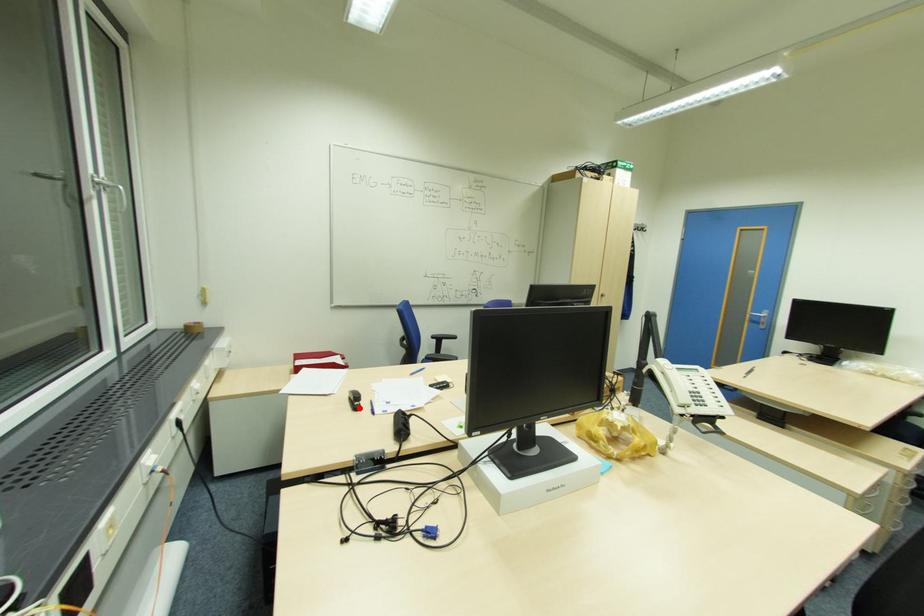
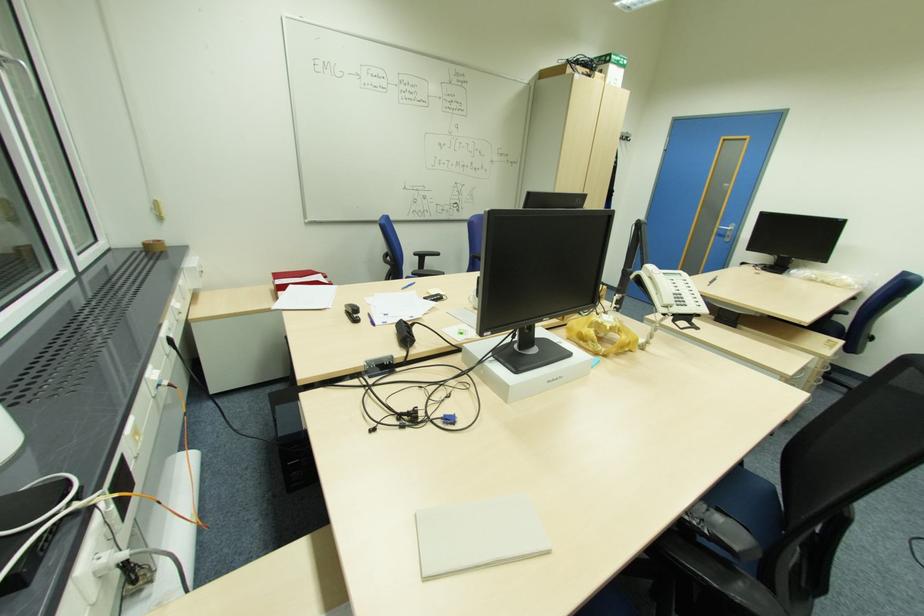
Find the pixel in the second image that matches the highlighted location in the first image.

(359, 321)